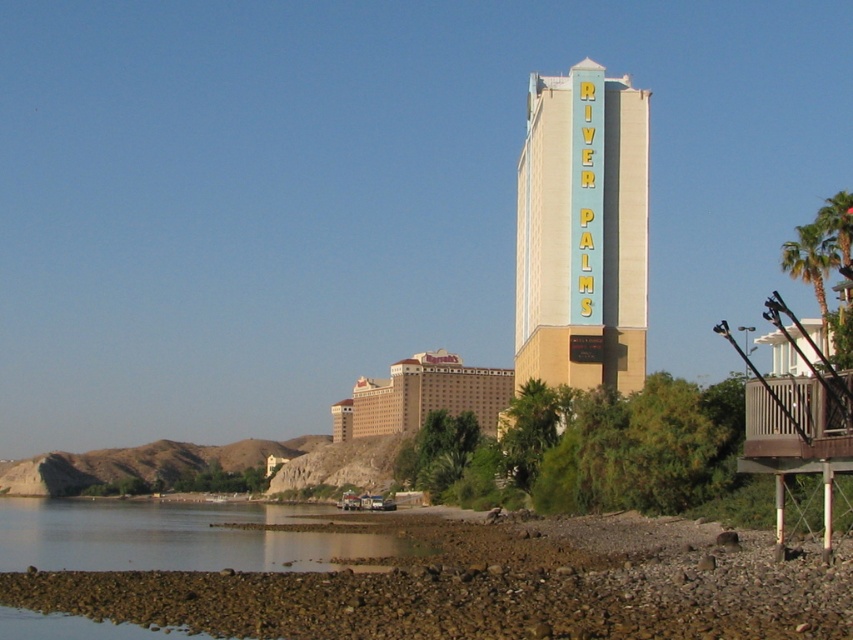
Question: Among these objects, which one is farthest from the camera?

Choices:
 (A) clear water at lower left
 (B) smooth gravel shoreline at lower center
 (C) beige/matte hotel at center

Answer: (C)

Question: Does clear water at lower left lie behind beige/matte hotel at center?

Choices:
 (A) yes
 (B) no

Answer: (B)

Question: Can you confirm if smooth gravel shoreline at lower center is smaller than clear water at lower left?

Choices:
 (A) no
 (B) yes

Answer: (B)

Question: Is smooth gravel shoreline at lower center thinner than light blue sign at center?

Choices:
 (A) no
 (B) yes

Answer: (A)

Question: Among these points, which one is nearest to the camera?

Choices:
 (A) (160, 561)
 (B) (494, 589)
 (C) (592, 316)

Answer: (B)

Question: Which of the following is the farthest from the observer?

Choices:
 (A) (213, 620)
 (B) (621, 179)
 (C) (821, 278)

Answer: (B)